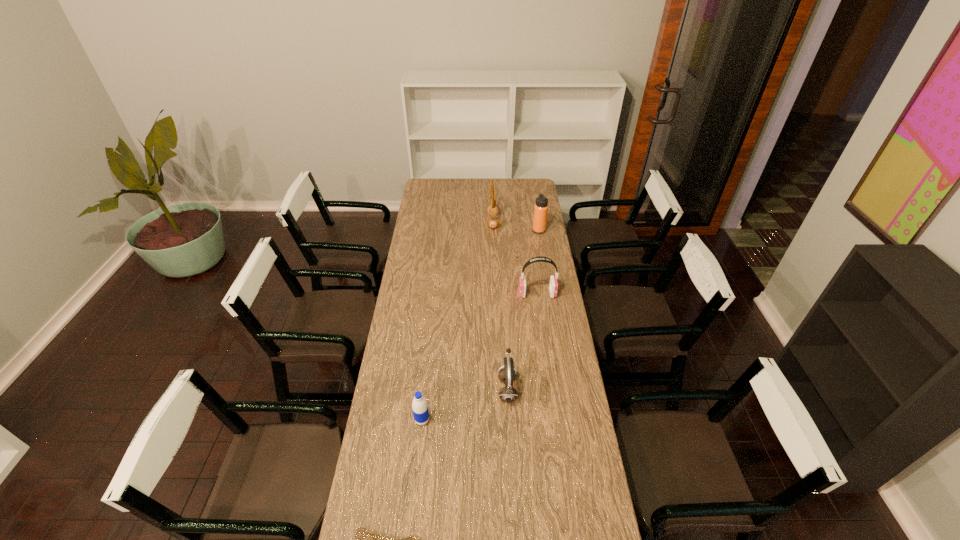
This screenshot has width=960, height=540. I want to click on free space that satisfies the following two spatial constraints: 1. on the back side of the thermos bottle; 2. on the right side of the fifth tallest object, so click(443, 231).

Find the location of a particular element. vacant point that satisfies the following two spatial constraints: 1. on the front-facing side of the farthest earphone; 2. on the back side of the thermos bottle is located at coordinates (493, 231).